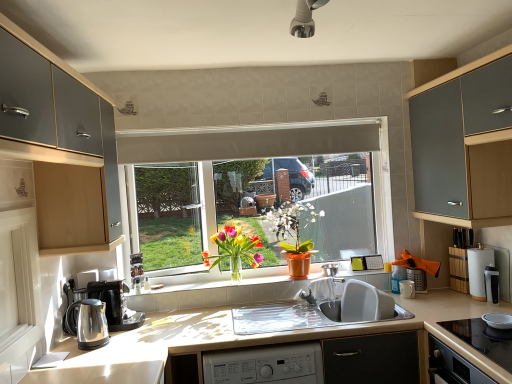
This screenshot has height=384, width=512. I want to click on free location to the left of black ceramic bowl at lower right, marked as the 2th appliance in a right-to-left arrangement, so click(468, 336).